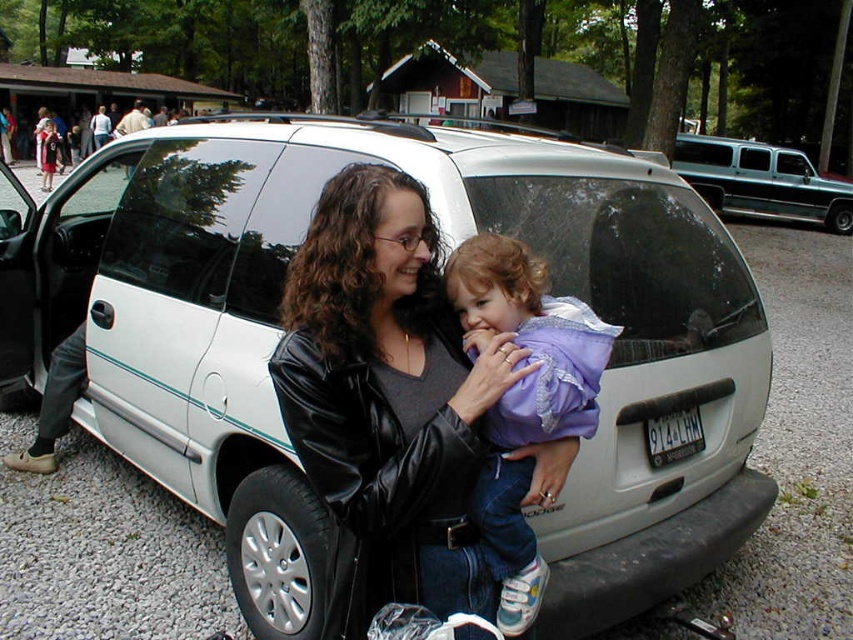
You are a delivery driver who needs to exit the parking lot. There are two vans in your way. The white matte van at center and the teal metallic van at right. Which van is blocking your path more directly?

The white matte van at center is blocking your path more directly because it is in front of the teal metallic van at right.

You are a photographer standing at the edge of the park and you want to take a photo of the white matte van at center and the purple fleece jacket at center. Which object should you focus on first to ensure it appears sharp in the photo?

You should focus on the white matte van at center first because it is closer to you than the purple fleece jacket at center, so it will appear sharp if focused on first.